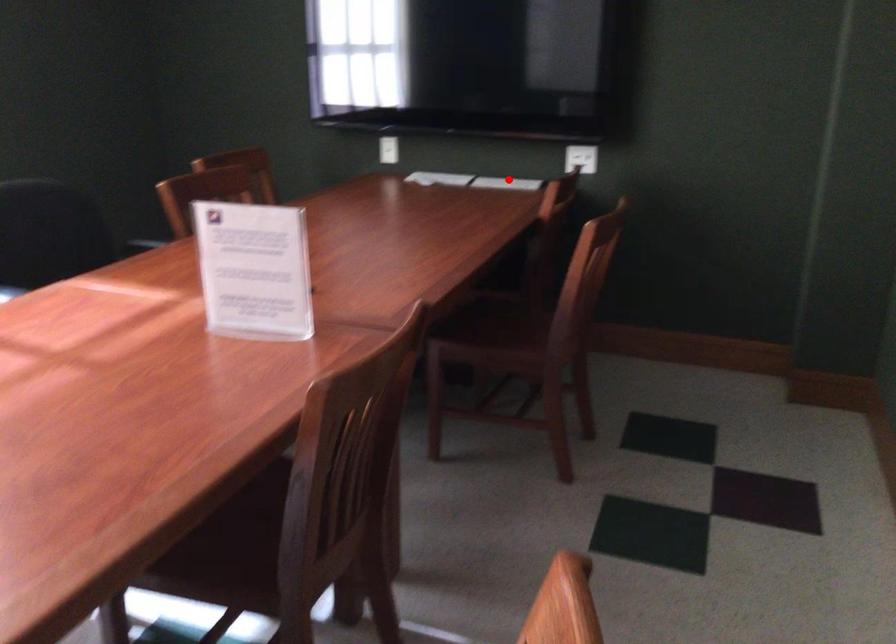
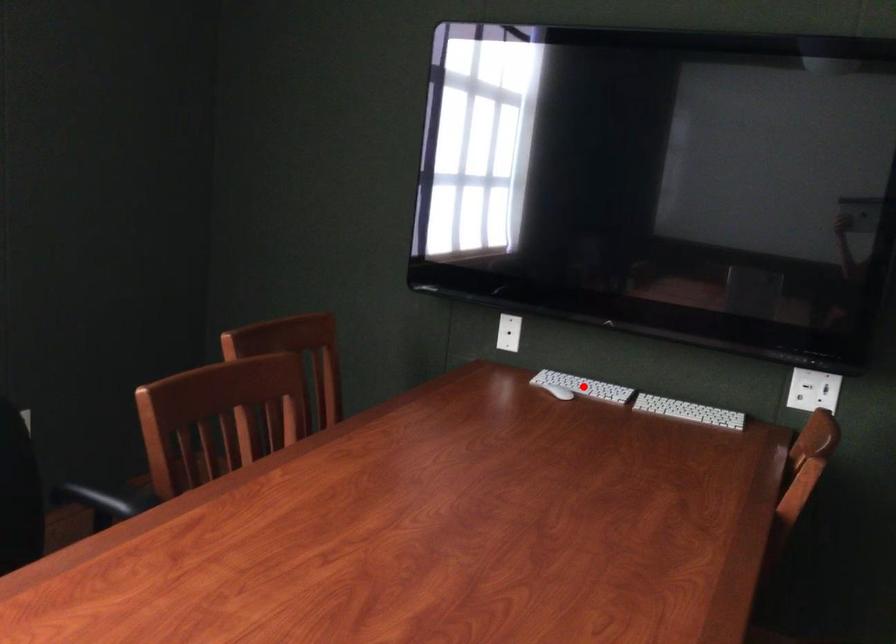
I am providing you with two images of the same scene from different viewpoints. A red point is marked on the first image and another point is marked on the second image. Is the red point in image1 aligned with the point shown in image2?

No